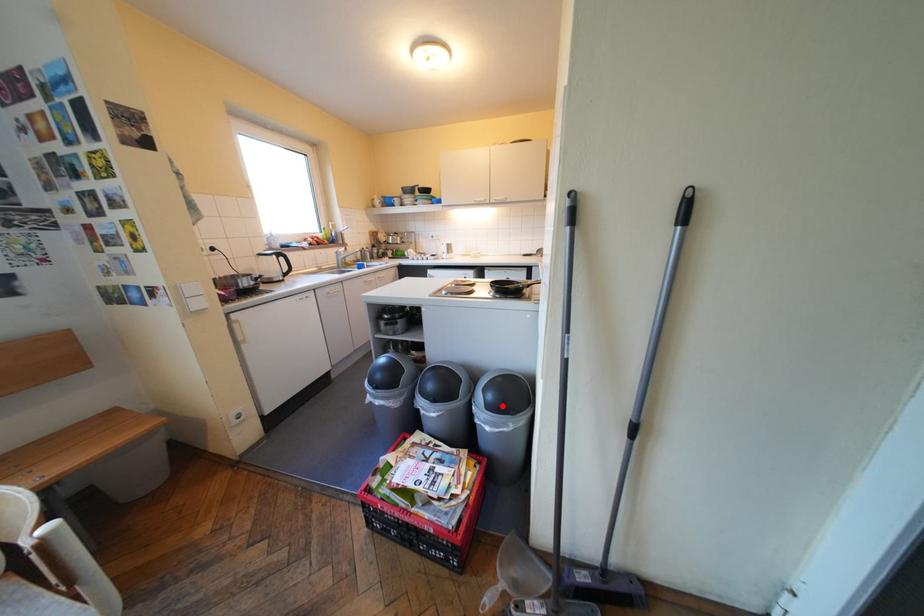
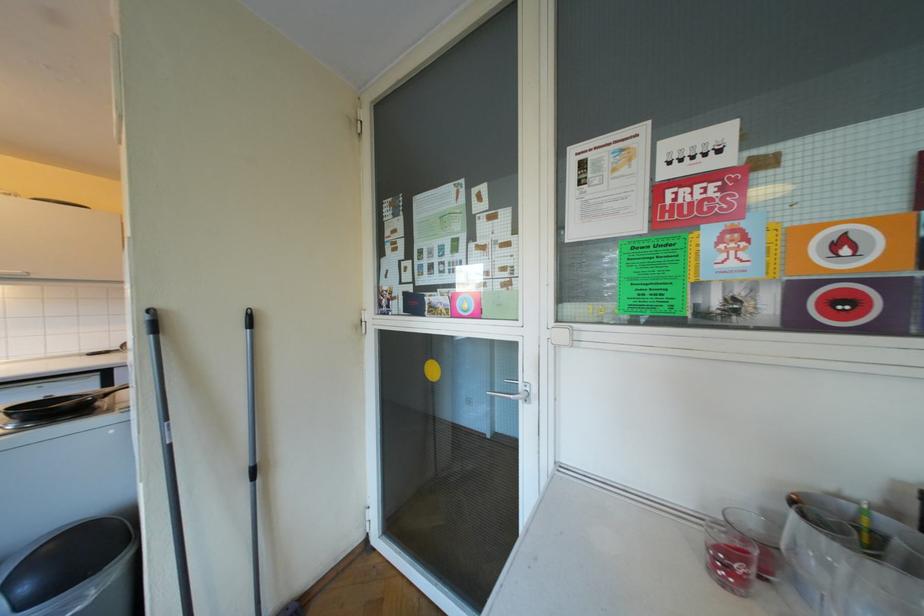
Question: I am providing you with two images of the same scene from different viewpoints. Image1 has a red point marked. In image2, the corresponding 3D location appears at what relative position? Reply with the corresponding letter.

Choices:
 (A) Closer
 (B) Farther

Answer: (A)